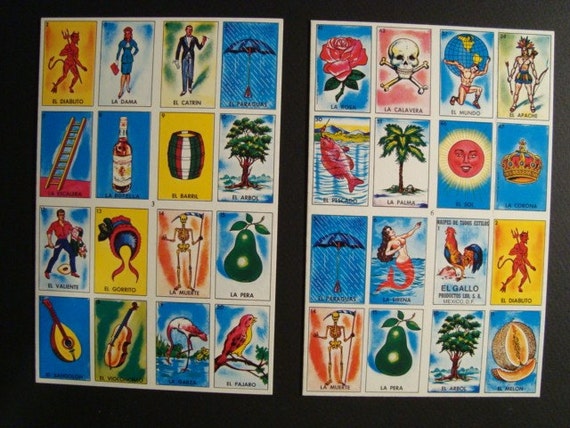
Where is `bottle`? bottle is located at coordinates (125, 147).